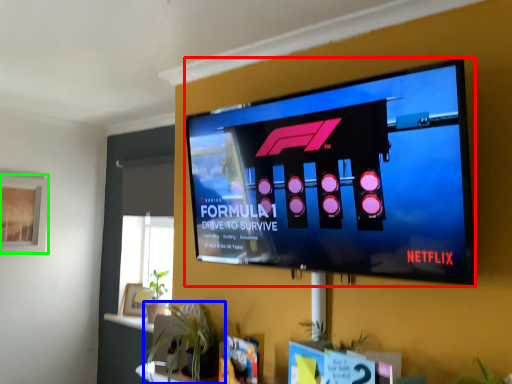
Question: Which object is positioned farthest from television (highlighted by a red box)? Select from houseplant (highlighted by a blue box) and window screen (highlighted by a green box).

Choices:
 (A) houseplant
 (B) window screen

Answer: (B)